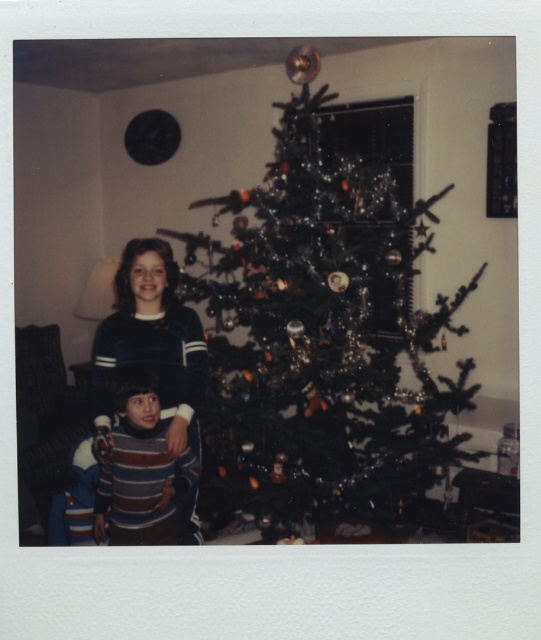
Between blue striped sweater at left and striped sweater at lower left, which one appears on the left side from the viewer's perspective?

From the viewer's perspective, striped sweater at lower left appears more on the left side.

The width and height of the screenshot is (541, 640). What are the coordinates of `blue striped sweater at left` in the screenshot? It's located at (153, 340).

Where is `blue striped sweater at left`? blue striped sweater at left is located at coordinates (153, 340).

Which of these two, green shiny christmas tree at center or striped sweater at lower left, stands taller?

green shiny christmas tree at center is taller.

Find the location of a particular element. green shiny christmas tree at center is located at coordinates (325, 323).

The width and height of the screenshot is (541, 640). What do you see at coordinates (325, 323) in the screenshot?
I see `green shiny christmas tree at center` at bounding box center [325, 323].

Is green shiny christmas tree at center closer to the viewer compared to blue striped sweater at left?

No, green shiny christmas tree at center is further to the viewer.

Where is `green shiny christmas tree at center`? green shiny christmas tree at center is located at coordinates (325, 323).

The width and height of the screenshot is (541, 640). Identify the location of green shiny christmas tree at center. (325, 323).